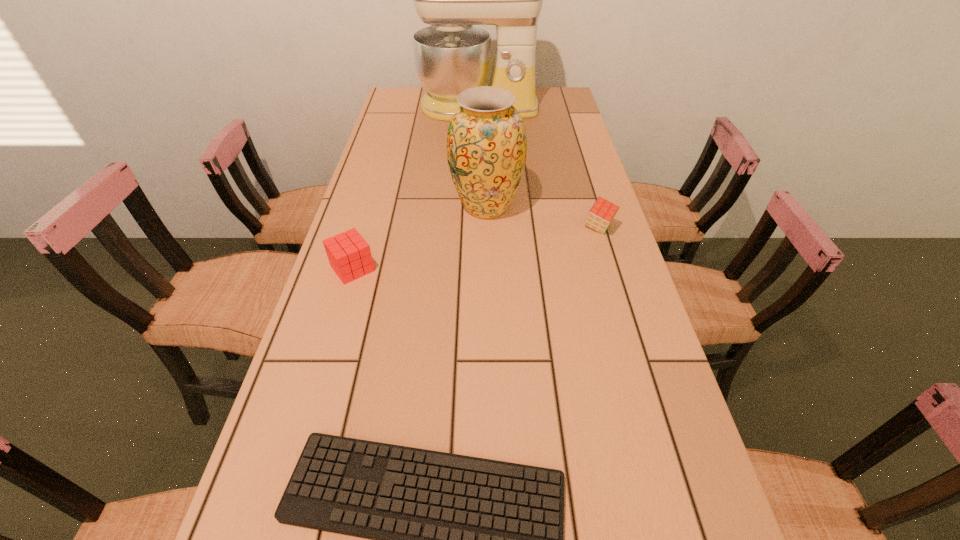
I want to click on free spot at the far left corner of the desktop, so click(x=400, y=105).

Identify the location of blank area at the far right corner. This screenshot has height=540, width=960. (568, 104).

You are a GUI agent. You are given a task and a screenshot of the screen. Output one action in this format:
    pyautogui.click(x=<x>, y=<y>)
    Task: Click on the vacant space that's between the vase and the right cube
    This screenshot has height=540, width=960.
    Given the screenshot: What is the action you would take?
    pyautogui.click(x=542, y=218)

Where is `the fourth closest object to the tallest object`? The image size is (960, 540). the fourth closest object to the tallest object is located at coordinates (457, 539).

You are a GUI agent. You are given a task and a screenshot of the screen. Output one action in this format:
    pyautogui.click(x=<x>, y=<y>)
    Task: Click on the fourth closest object to the shortest object
    This screenshot has height=540, width=960.
    Given the screenshot: What is the action you would take?
    pyautogui.click(x=451, y=55)

Image resolution: width=960 pixels, height=540 pixels. I want to click on free point that satisfies the following two spatial constraints: 1. on the back side of the second nearest object; 2. on the left side of the right cube, so click(365, 228).

Identify the location of free space in the image that satisfies the following two spatial constraints: 1. on the side of the mixer with the control knob; 2. on the right side of the second tallest object. (477, 207).

This screenshot has width=960, height=540. I want to click on vacant space that satisfies the following two spatial constraints: 1. on the side of the fourth shortest object with the control knob; 2. on the right side of the tallest object, so (x=477, y=207).

Identify the location of vacant space that satisfies the following two spatial constraints: 1. on the side of the tallest object with the control knob; 2. on the left side of the fourth shortest object. (477, 207).

Where is `vacant area that satisfies the following two spatial constraints: 1. on the side of the tallest object with the control knob; 2. on the left side of the fourth shortest object`? The width and height of the screenshot is (960, 540). vacant area that satisfies the following two spatial constraints: 1. on the side of the tallest object with the control knob; 2. on the left side of the fourth shortest object is located at coordinates (477, 207).